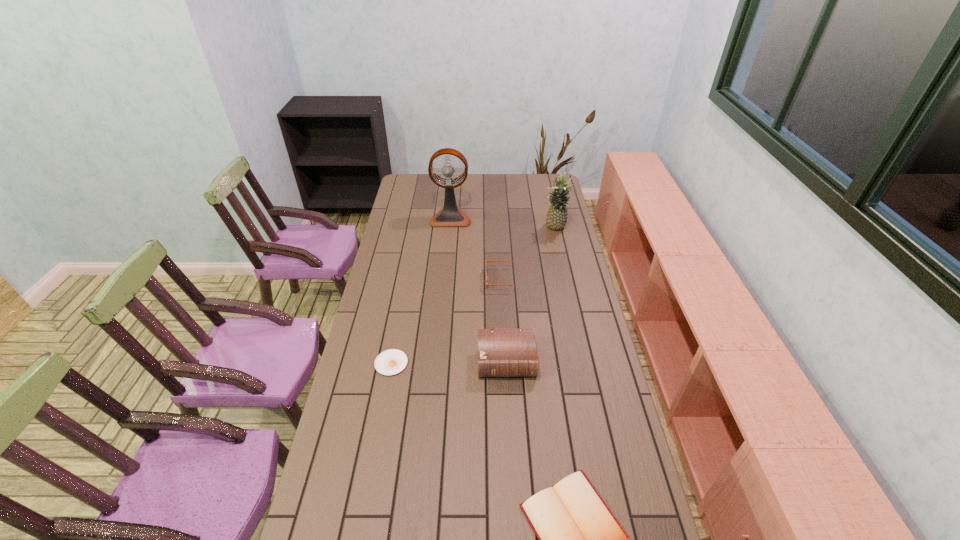
You are a GUI agent. You are given a task and a screenshot of the screen. Output one action in this format:
    pyautogui.click(x=<x>, y=<y>)
    Task: Click on the tallest object
    
    Given the screenshot: What is the action you would take?
    pyautogui.click(x=450, y=215)

Find the location of a particular element. fan is located at coordinates click(x=450, y=215).

Find the location of a particular element. Image resolution: width=960 pixels, height=540 pixels. pineapple is located at coordinates point(556,218).

Locate an element on the screen. the fourth shortest object is located at coordinates (512, 352).

The image size is (960, 540). Identify the location of the taller Bible. (512, 352).

The height and width of the screenshot is (540, 960). Find the location of `the third farthest object`. the third farthest object is located at coordinates (487, 284).

The height and width of the screenshot is (540, 960). Find the location of `the third shortest object`. the third shortest object is located at coordinates (487, 284).

I want to click on egg yolk, so click(x=390, y=362).

This screenshot has height=540, width=960. What are the coordinates of `the leftmost object` in the screenshot? It's located at coord(390,362).

At what (x,y) coordinates should I click in order to perform the action: click on vacant area situated 0.150m on the front-facing side of the fifth object from right to left. Please return your answer as a coordinate pair (x, y). This screenshot has width=960, height=540. Looking at the image, I should click on (448, 245).